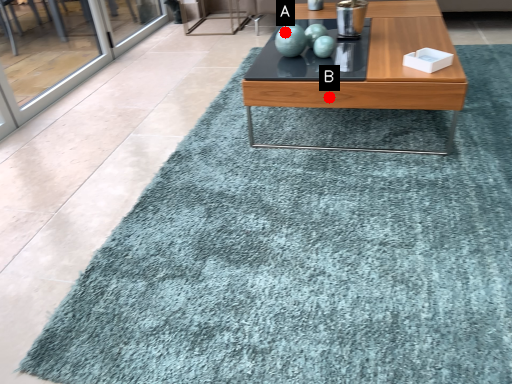
Question: Two points are circled on the image, labeled by A and B beside each circle. Which point is closer to the camera taking this photo?

Choices:
 (A) A is closer
 (B) B is closer

Answer: (B)